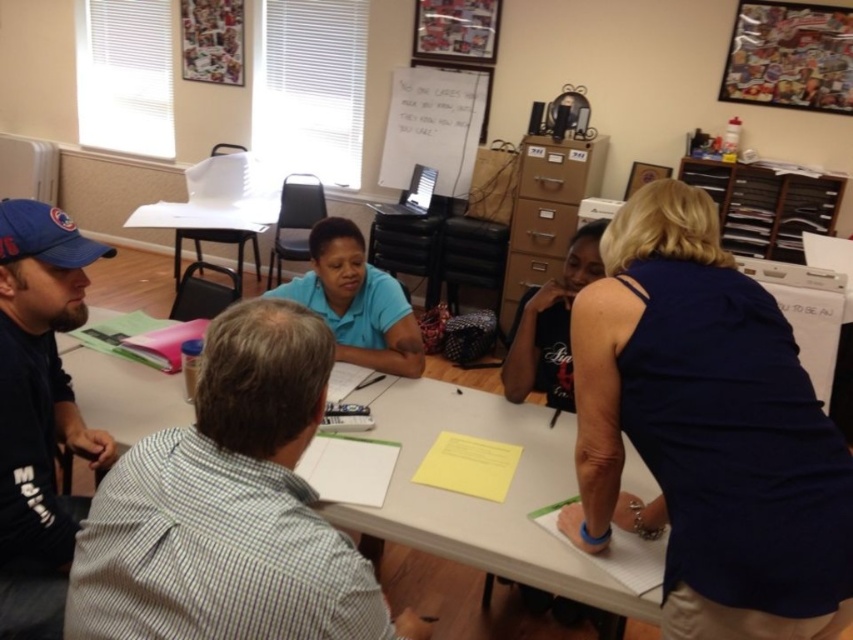
Is dark blue sleeveless top at upper right thinner than blue shirt at center?

Yes, dark blue sleeveless top at upper right is thinner than blue shirt at center.

Who is more distant from viewer, [817,576] or [368,291]?

The point [368,291] is behind.

Does point (671, 442) come farther from viewer compared to point (375, 268)?

No, (671, 442) is closer to viewer.

Where is `dark blue sleeveless top at upper right`? This screenshot has height=640, width=853. dark blue sleeveless top at upper right is located at coordinates (706, 432).

Is point (575, 538) farther from camera compared to point (466, 556)?

No.

Does dark blue sleeveless top at upper right have a lesser height compared to white paper at center?

No, dark blue sleeveless top at upper right is not shorter than white paper at center.

The width and height of the screenshot is (853, 640). What do you see at coordinates (706, 432) in the screenshot?
I see `dark blue sleeveless top at upper right` at bounding box center [706, 432].

I want to click on dark blue sleeveless top at upper right, so click(706, 432).

Does white paper at center have a lesser height compared to white paperboard at upper center?

Correct, white paper at center is not as tall as white paperboard at upper center.

Can you confirm if white paper at center is positioned below white paperboard at upper center?

Indeed, white paper at center is positioned under white paperboard at upper center.

Between point (386, 500) and point (412, 148), which one is positioned behind?

Positioned behind is point (412, 148).

Image resolution: width=853 pixels, height=640 pixels. I want to click on white paper at center, so click(485, 499).